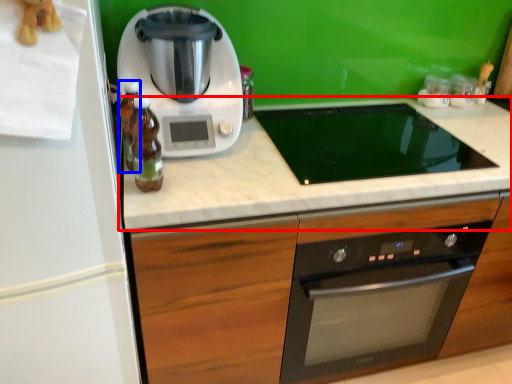
Question: Which object is further to the camera taking this photo, countertop (highlighted by a red box) or bottle (highlighted by a blue box)?

Choices:
 (A) countertop
 (B) bottle

Answer: (A)